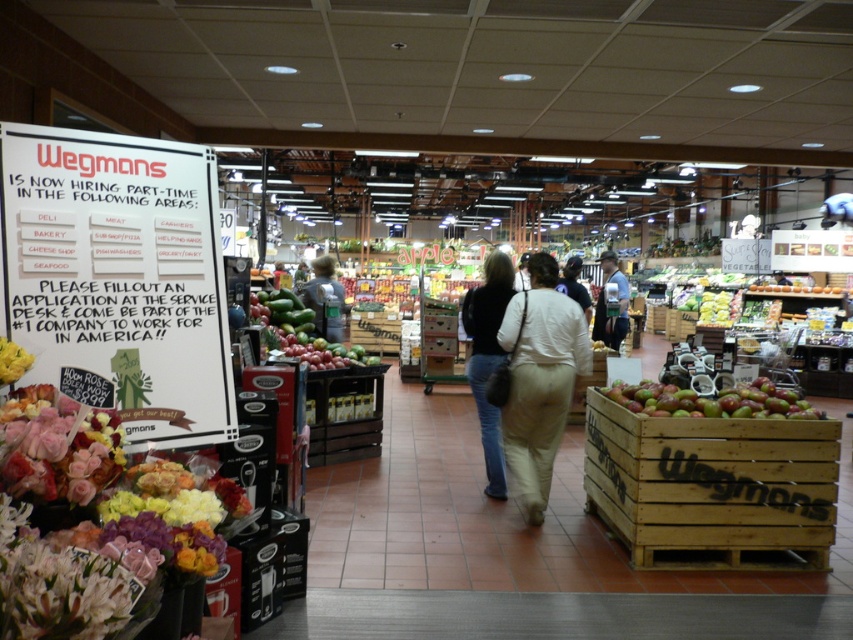
Question: Does wooden crate of apples at center have a greater width compared to matte pink roses at left?

Choices:
 (A) yes
 (B) no

Answer: (A)

Question: Among these points, which one is farthest from the camera?

Choices:
 (A) (281, 330)
 (B) (538, 369)
 (C) (589, 321)

Answer: (C)

Question: Among these objects, which one is farthest from the camera?

Choices:
 (A) green matte avocados at center
 (B) light beige pants at center

Answer: (B)

Question: Is white cotton pants at center above green matte apples at center-right?

Choices:
 (A) yes
 (B) no

Answer: (A)

Question: Is wooden crate at center-right smaller than green matte apples at center-right?

Choices:
 (A) yes
 (B) no

Answer: (B)

Question: Which of the following is the closest to the observer?

Choices:
 (A) light beige pants at center
 (B) denim jacket at center
 (C) green matte apples at center-right

Answer: (C)